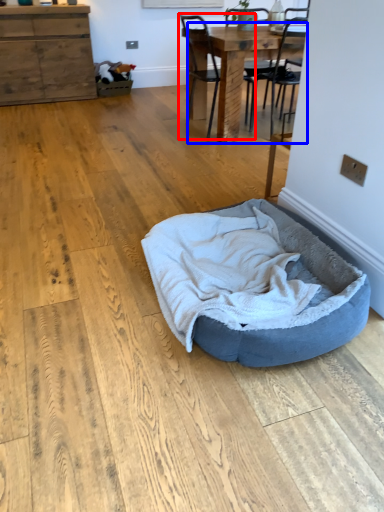
Question: Among these objects, which one is nearest to the camera, chair (highlighted by a red box) or table (highlighted by a blue box)?

Choices:
 (A) chair
 (B) table

Answer: (B)